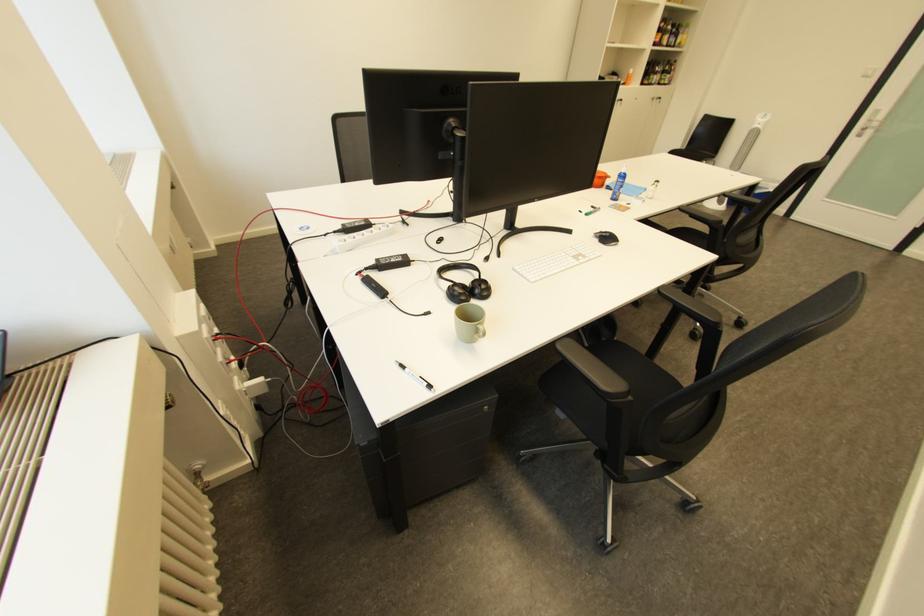
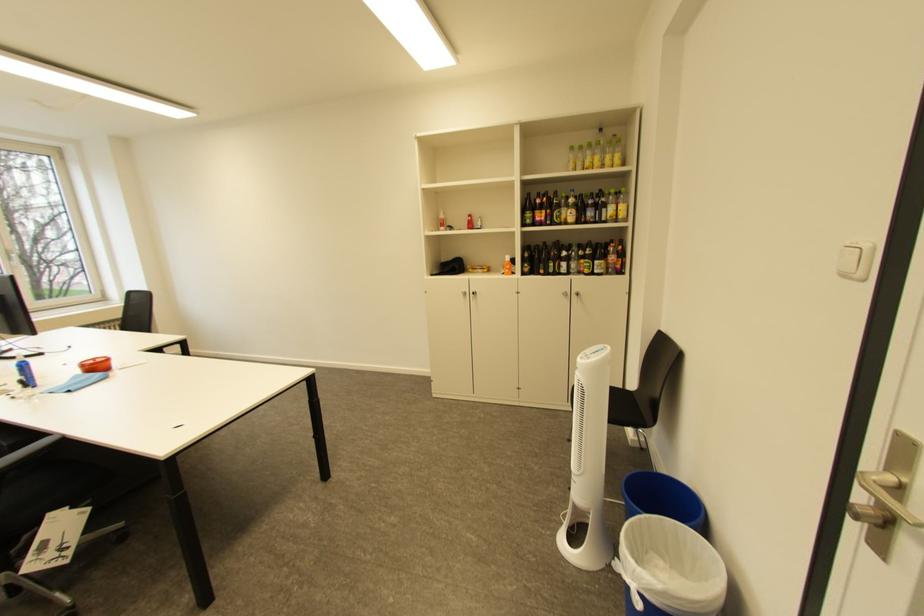
In the second image, find the point that corresponds to (776,188) in the first image.

(636, 570)